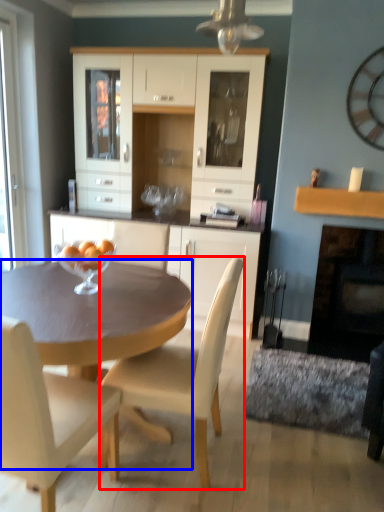
Question: Which object is closer to the camera taking this photo, chair (highlighted by a red box) or desk (highlighted by a blue box)?

Choices:
 (A) chair
 (B) desk

Answer: (B)